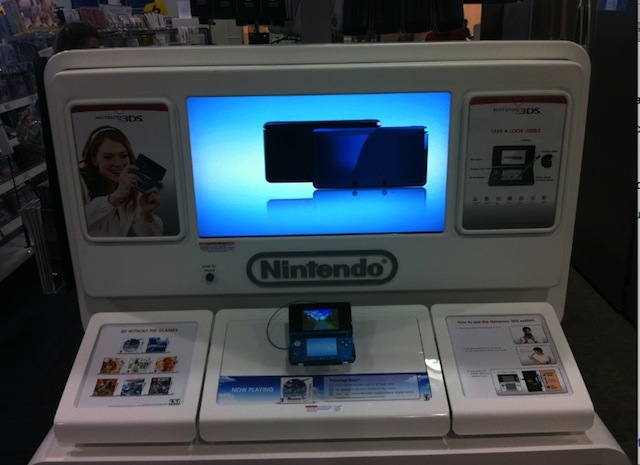
Where is `white table`? The height and width of the screenshot is (465, 640). white table is located at coordinates (377, 455).